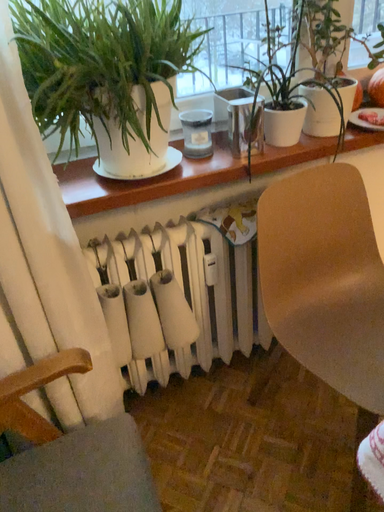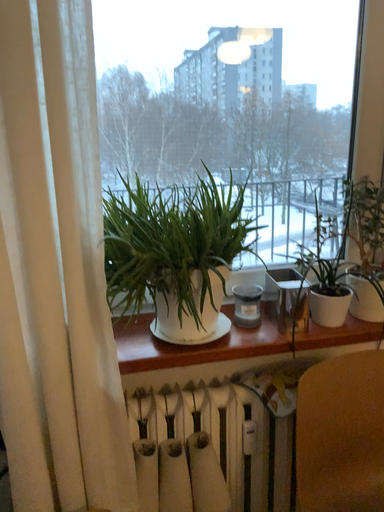
Question: How did the camera likely rotate when shooting the video?

Choices:
 (A) rotated left
 (B) rotated right

Answer: (A)